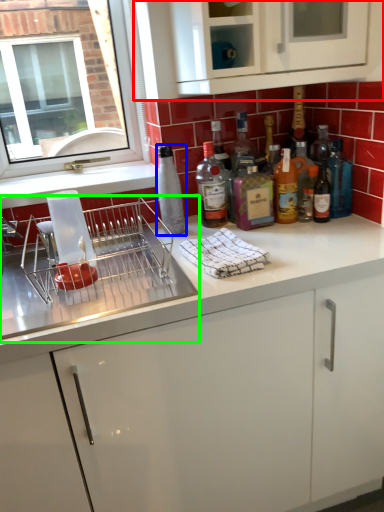
Question: Based on their relative distances, which object is farther from cabinetry (highlighted by a red box)? Choose from bottle (highlighted by a blue box) and appliance (highlighted by a green box).

Choices:
 (A) bottle
 (B) appliance

Answer: (B)